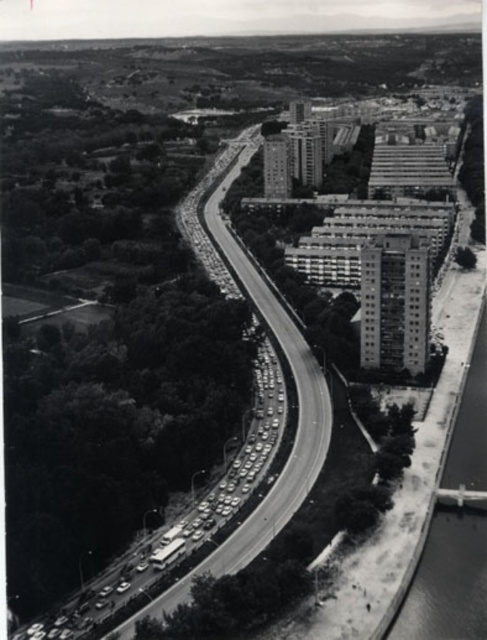
You are a drone operator flying a drone over the urban scene. You need to fly your drone from point A to point B. Point A is located at point [187,218] and point B is at point [450,422]. Given the highway runs from the bottom left to the top right, which direction should you fly your drone to go from point A to point B?

To fly from point A to point B, you should fly towards the northeast direction since point B is northeast of point A based on their coordinates.

You are a drone operator trying to capture a photo of the smooth asphalt highway at lower left and the smooth concrete river at right. From your current position, which one is closer to you?

The smooth asphalt highway at lower left is closer to you because the smooth concrete river at right is behind it.

You are a city planner analyzing this aerial view. You need to determine which of the two structures, the smooth asphalt highway at lower left or the smooth concrete river at right, occupies more space in the image. Based on the scene, which one is larger?

The smooth asphalt highway at lower left is bigger than the smooth concrete river at right, so the highway occupies more space in the image.